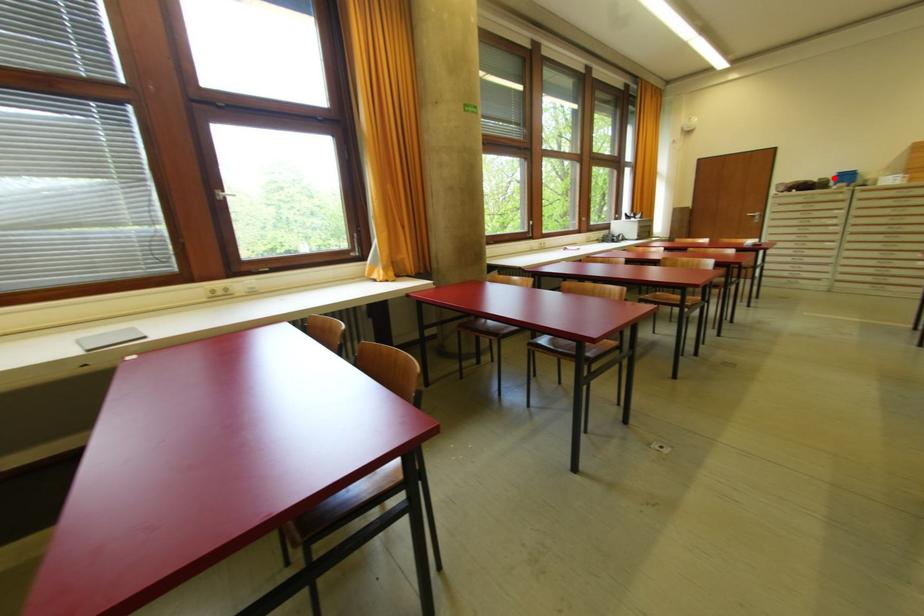
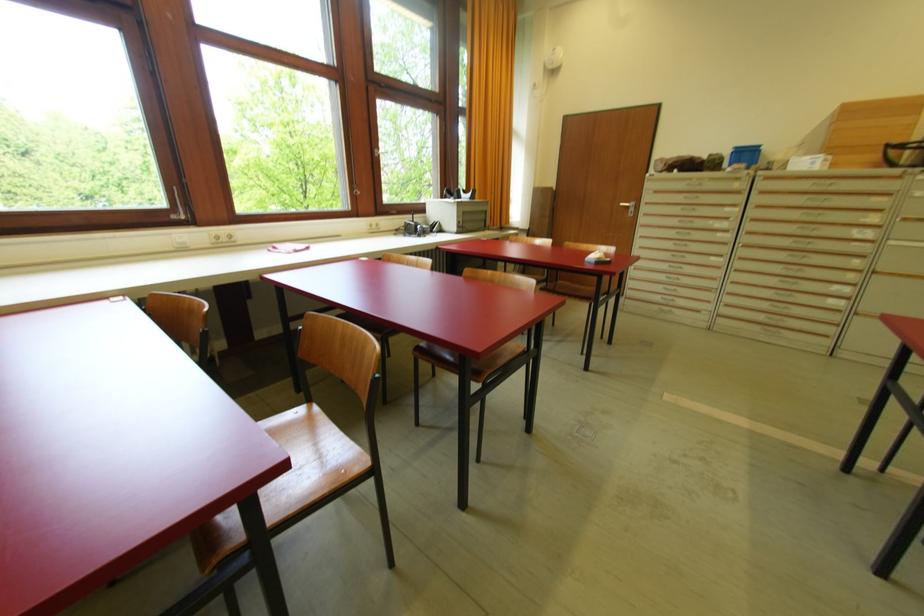
Question: I am providing you with two images of the same scene from different viewpoints. Given a red point in image1, look at the same physical point in image2. Is it:

Choices:
 (A) Closer to the viewpoint
 (B) Farther from the viewpoint

Answer: (A)